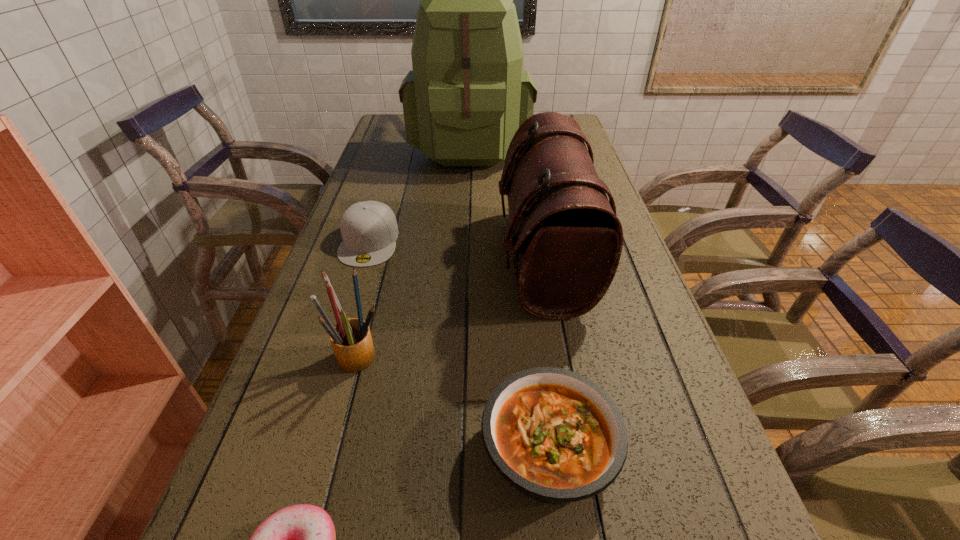
Find the location of a particular element. backpack is located at coordinates (467, 95).

Identify the location of the farthest object. The image size is (960, 540). (467, 95).

This screenshot has width=960, height=540. Find the location of `satchel`. satchel is located at coordinates (562, 229).

I want to click on the fourth shortest object, so click(351, 340).

You are a GUI agent. You are given a task and a screenshot of the screen. Output one action in this format:
    pyautogui.click(x=<x>, y=<y>)
    Task: Click on the pencil box
    
    Given the screenshot: What is the action you would take?
    pyautogui.click(x=351, y=340)

Image resolution: width=960 pixels, height=540 pixels. I want to click on cap, so pos(369,229).

The height and width of the screenshot is (540, 960). What are the coordinates of `the second shortest object` in the screenshot? It's located at (558, 437).

Find the location of `free space located 0.400m on the front pocket of the tallest object`. free space located 0.400m on the front pocket of the tallest object is located at coordinates 466,256.

Find the location of a particular element. The image size is (960, 540). vacant space located on the front-facing side of the fifth shortest object is located at coordinates (342, 259).

This screenshot has height=540, width=960. I want to click on vacant area situated on the front-facing side of the fifth shortest object, so click(478, 259).